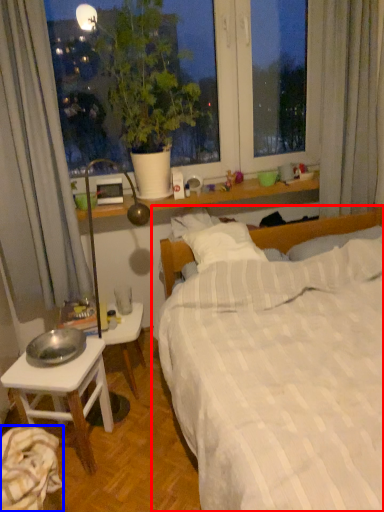
Question: Which object is closer to the camera taking this photo, bed (highlighted by a red box) or sheet (highlighted by a blue box)?

Choices:
 (A) bed
 (B) sheet

Answer: (A)